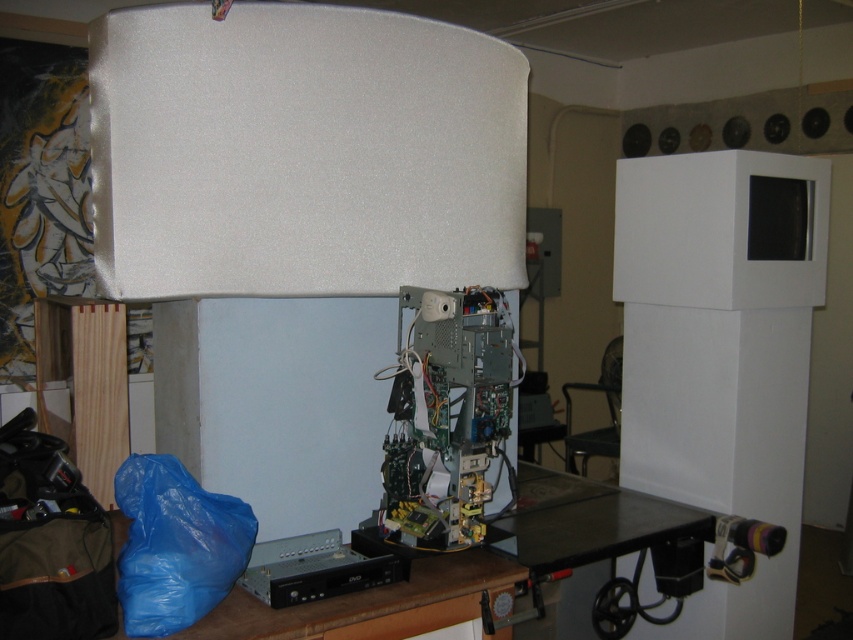
Can you confirm if green circuit board at center is positioned to the right of metallic gray dvd player at lower center?

Indeed, green circuit board at center is positioned on the right side of metallic gray dvd player at lower center.

What do you see at coordinates (445, 413) in the screenshot? I see `green circuit board at center` at bounding box center [445, 413].

Which is behind, point (469, 488) or point (299, 588)?

Positioned behind is point (469, 488).

Locate an element on the screen. The width and height of the screenshot is (853, 640). green circuit board at center is located at coordinates (445, 413).